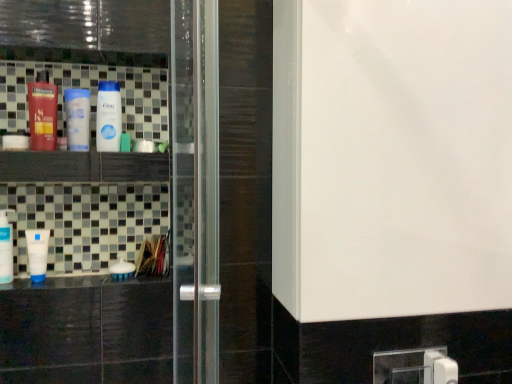
How much space does white matte bottle at left, which ranks as the third bottle in right-to-left order, occupy horizontally?

It is 3.00 inches.

Describe the element at coordinates (81, 282) in the screenshot. The height and width of the screenshot is (384, 512). I see `white glossy counter top at lower left` at that location.

What do you see at coordinates (108, 117) in the screenshot? The width and height of the screenshot is (512, 384). I see `white glossy bottle at center, which is the 2th bottle from right to left` at bounding box center [108, 117].

Where is `white glossy tube at left, which is the first bottle in left-to-right order`? The image size is (512, 384). white glossy tube at left, which is the first bottle in left-to-right order is located at coordinates (6, 248).

The width and height of the screenshot is (512, 384). Identify the location of transparent glass screen door at center. pyautogui.click(x=88, y=334).

I want to click on white matte bottle at center, positioned as the 6th bottle in left-to-right order, so click(122, 270).

Can you confirm if matte black bottle at left, positioned as the third bottle in left-to-right order, is wider than white glossy bottle at center, which is the 2th bottle from right to left?

Correct, the width of matte black bottle at left, positioned as the third bottle in left-to-right order, exceeds that of white glossy bottle at center, which is the 2th bottle from right to left.

From the image's perspective, which one is positioned lower, matte black bottle at left, positioned as the third bottle in left-to-right order, or white glossy bottle at center, which is the 2th bottle from right to left?

white glossy bottle at center, which is the 2th bottle from right to left.

In the image, is matte black bottle at left, which is the fourth bottle from right to left, positioned in front of or behind white glossy bottle at center, which is counted as the 5th bottle, starting from the left?

matte black bottle at left, which is the fourth bottle from right to left, is positioned closer to the viewer than white glossy bottle at center, which is counted as the 5th bottle, starting from the left.

Looking at this image, could you tell me if matte black bottle at left, positioned as the third bottle in left-to-right order, is facing white glossy bottle at center, which is counted as the 5th bottle, starting from the left?

No, matte black bottle at left, positioned as the third bottle in left-to-right order, is not turned towards white glossy bottle at center, which is counted as the 5th bottle, starting from the left.

Is white matte bottle at left, which appears as the 4th bottle when viewed from the left, facing towards white matte tube at lower left, placed as the second bottle when sorted from left to right?

No, white matte bottle at left, which appears as the 4th bottle when viewed from the left, is not aimed at white matte tube at lower left, placed as the second bottle when sorted from left to right.

From a real-world perspective, is white matte bottle at left, which appears as the 4th bottle when viewed from the left, over white matte tube at lower left, placed as the second bottle when sorted from left to right?

Indeed, from a real-world perspective, white matte bottle at left, which appears as the 4th bottle when viewed from the left, stands above white matte tube at lower left, placed as the second bottle when sorted from left to right.

Based on the photo, considering the relative positions of white matte bottle at left, which ranks as the third bottle in right-to-left order, and white matte tube at lower left, which ranks as the fifth bottle in right-to-left order, in the image provided, is white matte bottle at left, which ranks as the third bottle in right-to-left order, to the right of white matte tube at lower left, which ranks as the fifth bottle in right-to-left order, from the viewer's perspective?

Yes, white matte bottle at left, which ranks as the third bottle in right-to-left order, is to the right of white matte tube at lower left, which ranks as the fifth bottle in right-to-left order.

Can we say white matte bottle at left, which appears as the 4th bottle when viewed from the left, lies outside white matte tube at lower left, which ranks as the fifth bottle in right-to-left order?

That's correct, white matte bottle at left, which appears as the 4th bottle when viewed from the left, is outside of white matte tube at lower left, which ranks as the fifth bottle in right-to-left order.

Is white glossy tube at left, arranged as the sixth bottle when viewed from the right, aimed at white matte bottle at left, which ranks as the third bottle in right-to-left order?

No, white glossy tube at left, arranged as the sixth bottle when viewed from the right, does not turn towards white matte bottle at left, which ranks as the third bottle in right-to-left order.

Considering the sizes of objects white glossy tube at left, which is the first bottle in left-to-right order, and white matte bottle at left, which ranks as the third bottle in right-to-left order, in the image provided, who is taller, white glossy tube at left, which is the first bottle in left-to-right order, or white matte bottle at left, which ranks as the third bottle in right-to-left order,?

white glossy tube at left, which is the first bottle in left-to-right order, is taller.

Do you think white glossy tube at left, arranged as the sixth bottle when viewed from the right, is within white matte bottle at left, which appears as the 4th bottle when viewed from the left, or outside of it?

white glossy tube at left, arranged as the sixth bottle when viewed from the right, is located beyond the bounds of white matte bottle at left, which appears as the 4th bottle when viewed from the left.

Considering the relative positions of white glossy tube at left, which is the first bottle in left-to-right order, and white matte bottle at left, which appears as the 4th bottle when viewed from the left, in the image provided, is white glossy tube at left, which is the first bottle in left-to-right order, to the left of white matte bottle at left, which appears as the 4th bottle when viewed from the left, from the viewer's perspective?

Yes, white glossy tube at left, which is the first bottle in left-to-right order, is to the left of white matte bottle at left, which appears as the 4th bottle when viewed from the left.

How many degrees apart are the facing directions of transparent glass screen door at center and white glossy counter top at lower left?

transparent glass screen door at center and white glossy counter top at lower left are facing 0.326 degrees away from each other.

Is transparent glass screen door at center spatially inside white glossy counter top at lower left, or outside of it?

transparent glass screen door at center is not inside white glossy counter top at lower left, it's outside.

Are transparent glass screen door at center and white glossy counter top at lower left beside each other?

No, transparent glass screen door at center is not next to white glossy counter top at lower left.

How distant is transparent glass screen door at center from white glossy counter top at lower left?

5.76 inches.

Based on the photo, could you tell me if transparent glass screen door at center is turned towards white matte tube at lower left, placed as the second bottle when sorted from left to right?

No, transparent glass screen door at center does not turn towards white matte tube at lower left, placed as the second bottle when sorted from left to right.

Can you confirm if transparent glass screen door at center is positioned to the left of white matte tube at lower left, placed as the second bottle when sorted from left to right?

No, transparent glass screen door at center is not to the left of white matte tube at lower left, placed as the second bottle when sorted from left to right.

Looking at the image, does transparent glass screen door at center seem bigger or smaller compared to white matte tube at lower left, placed as the second bottle when sorted from left to right?

Clearly, transparent glass screen door at center is larger in size than white matte tube at lower left, placed as the second bottle when sorted from left to right.

Is white glossy tube at left, which is the first bottle in left-to-right order, taller than white matte bottle at center, positioned as the 6th bottle in left-to-right order?

Indeed, white glossy tube at left, which is the first bottle in left-to-right order, has a greater height compared to white matte bottle at center, positioned as the 6th bottle in left-to-right order.

Is white glossy tube at left, which is the first bottle in left-to-right order, positioned before white matte bottle at center, positioned as the 6th bottle in left-to-right order?

That is True.

From a real-world perspective, starting from the white glossy tube at left, arranged as the sixth bottle when viewed from the right, which bottle is the 2nd one below it? Please provide its 2D coordinates.

[(122, 270)]

From a real-world perspective, is white glossy tube at left, which is the first bottle in left-to-right order, above or below white matte bottle at center, positioned as the 1th bottle in right-to-left order?

Clearly, from a real-world perspective, white glossy tube at left, which is the first bottle in left-to-right order, is above white matte bottle at center, positioned as the 1th bottle in right-to-left order.

Would you say white glossy tube at left, which is the first bottle in left-to-right order, is inside or outside white glossy counter top at lower left?

white glossy tube at left, which is the first bottle in left-to-right order, is located beyond the bounds of white glossy counter top at lower left.

From a real-world perspective, is white glossy tube at left, which is the first bottle in left-to-right order, above or below white glossy counter top at lower left?

white glossy tube at left, which is the first bottle in left-to-right order, is above white glossy counter top at lower left.

Are white glossy tube at left, arranged as the sixth bottle when viewed from the right, and white glossy counter top at lower left far apart?

No, there isn't a large distance between white glossy tube at left, arranged as the sixth bottle when viewed from the right, and white glossy counter top at lower left.

Considering the relative sizes of white glossy tube at left, which is the first bottle in left-to-right order, and white glossy counter top at lower left in the image provided, is white glossy tube at left, which is the first bottle in left-to-right order, shorter than white glossy counter top at lower left?

No.

This screenshot has height=384, width=512. I want to click on the 2nd bottle above the white glossy bottle at center, which is counted as the 5th bottle, starting from the left (from the image's perspective), so click(x=42, y=113).

Locate an element on the screen. The width and height of the screenshot is (512, 384). bottle that is the 2nd one when counting backward from the white matte bottle at left, which appears as the 4th bottle when viewed from the left is located at coordinates (37, 253).

When comparing their distances from white glossy tube at left, which is the first bottle in left-to-right order, does transparent glass screen door at center or white matte bottle at left, which ranks as the third bottle in right-to-left order, seem further?

white matte bottle at left, which ranks as the third bottle in right-to-left order, is positioned further to the anchor white glossy tube at left, which is the first bottle in left-to-right order.

Based on the photo, based on their spatial positions, is matte black bottle at left, positioned as the third bottle in left-to-right order, or white matte bottle at left, which ranks as the third bottle in right-to-left order, further from white matte bottle at center, positioned as the 1th bottle in right-to-left order?

Among the two, matte black bottle at left, positioned as the third bottle in left-to-right order, is located further to white matte bottle at center, positioned as the 1th bottle in right-to-left order.

From the image, which object appears to be farther from white glossy tube at left, which is the first bottle in left-to-right order, white matte tube at lower left, placed as the second bottle when sorted from left to right, or transparent glass screen door at center?

Among the two, transparent glass screen door at center is located further to white glossy tube at left, which is the first bottle in left-to-right order.

When comparing their distances from white glossy bottle at center, which is the 2th bottle from right to left, does transparent glass screen door at center or white matte bottle at center, positioned as the 1th bottle in right-to-left order, seem further?

white matte bottle at center, positioned as the 1th bottle in right-to-left order, lies further to white glossy bottle at center, which is the 2th bottle from right to left, than the other object.

Looking at this image, estimate the real-world distances between objects in this image. Which object is closer to white matte bottle at center, positioned as the 1th bottle in right-to-left order, matte black bottle at left, which is the fourth bottle from right to left, or transparent glass screen door at center?

The object closer to white matte bottle at center, positioned as the 1th bottle in right-to-left order, is transparent glass screen door at center.

Looking at the image, which one is located closer to white glossy bottle at center, which is the 2th bottle from right to left, white matte bottle at center, positioned as the 6th bottle in left-to-right order, or transparent glass screen door at center?

Based on the image, transparent glass screen door at center appears to be nearer to white glossy bottle at center, which is the 2th bottle from right to left.

Looking at the image, which one is located further to transparent glass screen door at center, white matte tube at lower left, which ranks as the fifth bottle in right-to-left order, or white matte bottle at left, which appears as the 4th bottle when viewed from the left?

white matte bottle at left, which appears as the 4th bottle when viewed from the left, is positioned further to the anchor transparent glass screen door at center.

Based on their spatial positions, is white glossy bottle at center, which is counted as the 5th bottle, starting from the left, or white matte tube at lower left, which ranks as the fifth bottle in right-to-left order, further from white matte bottle at left, which ranks as the third bottle in right-to-left order?

white matte tube at lower left, which ranks as the fifth bottle in right-to-left order, lies further to white matte bottle at left, which ranks as the third bottle in right-to-left order, than the other object.

Locate an element on the screen. bottle situated between matte black bottle at left, which is the fourth bottle from right to left, and white glossy bottle at center, which is the 2th bottle from right to left, from left to right is located at coordinates (x=77, y=118).

The image size is (512, 384). I want to click on counter top located between transparent glass screen door at center and matte black bottle at left, which is the fourth bottle from right to left, in the depth direction, so click(81, 282).

This screenshot has width=512, height=384. I want to click on counter top positioned between transparent glass screen door at center and white matte tube at lower left, which ranks as the fifth bottle in right-to-left order, from near to far, so click(81, 282).

At what (x,y) coordinates should I click in order to perform the action: click on bottle between white glossy bottle at center, which is counted as the 5th bottle, starting from the left, and white matte tube at lower left, placed as the second bottle when sorted from left to right, vertically. Please return your answer as a coordinate pair (x, y). This screenshot has height=384, width=512. Looking at the image, I should click on (6, 248).